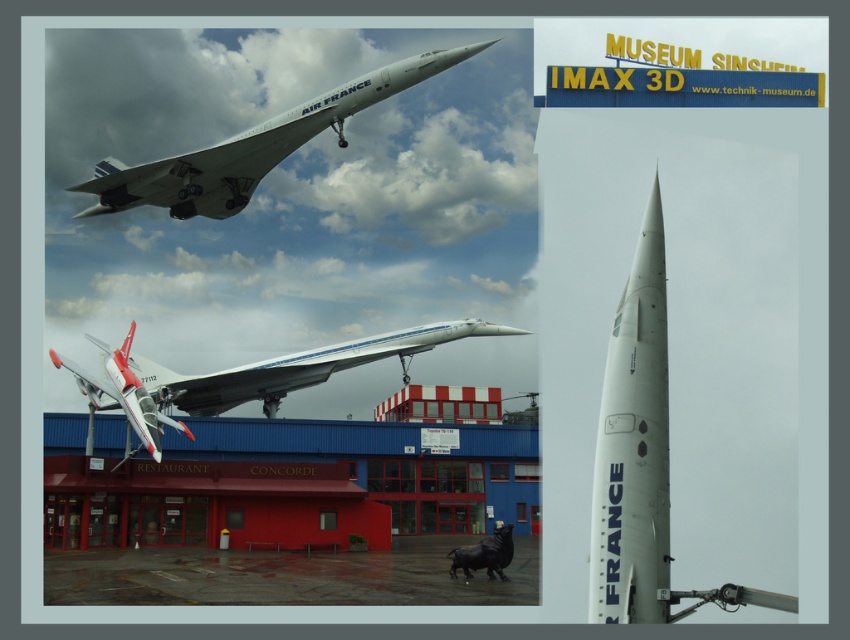
Question: Among these objects, which one is farthest from the camera?

Choices:
 (A) white glossy airplane at upper center
 (B) red matte building at center
 (C) white glossy airplane at center

Answer: (B)

Question: Which of the following is the closest to the observer?

Choices:
 (A) white glossy airplane at center
 (B) white glossy airplane at upper center

Answer: (B)

Question: Can you confirm if white matte concorde at center is thinner than white glossy airplane at center?

Choices:
 (A) yes
 (B) no

Answer: (A)

Question: Can you confirm if red matte building at center is bigger than white matte concorde at center?

Choices:
 (A) yes
 (B) no

Answer: (A)

Question: Which of the following is the farthest from the observer?

Choices:
 (A) (664, 586)
 (B) (425, 499)
 (C) (133, 449)

Answer: (B)

Question: Does white matte concorde at center appear on the right side of white glossy airplane at upper center?

Choices:
 (A) no
 (B) yes

Answer: (B)